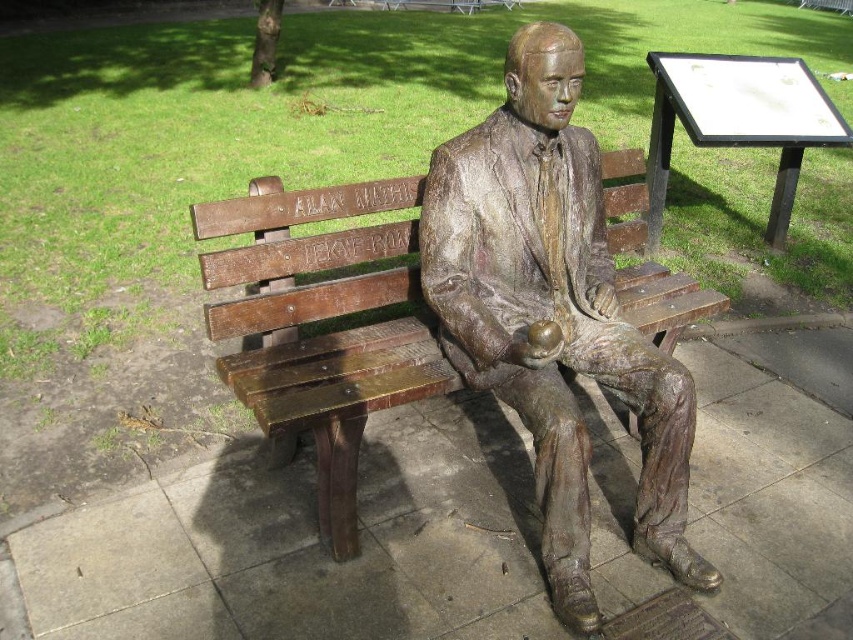
Question: Is bronze statue at center to the right of bronze wood bench at center from the viewer's perspective?

Choices:
 (A) yes
 (B) no

Answer: (A)

Question: Which point is farther to the camera?

Choices:
 (A) (477, 301)
 (B) (688, 294)

Answer: (B)

Question: Which of the following is the closest to the observer?

Choices:
 (A) (595, 202)
 (B) (254, 246)

Answer: (B)

Question: Is bronze statue at center to the right of bronze wood bench at center from the viewer's perspective?

Choices:
 (A) no
 (B) yes

Answer: (B)

Question: Is bronze statue at center thinner than bronze wood bench at center?

Choices:
 (A) no
 (B) yes

Answer: (A)